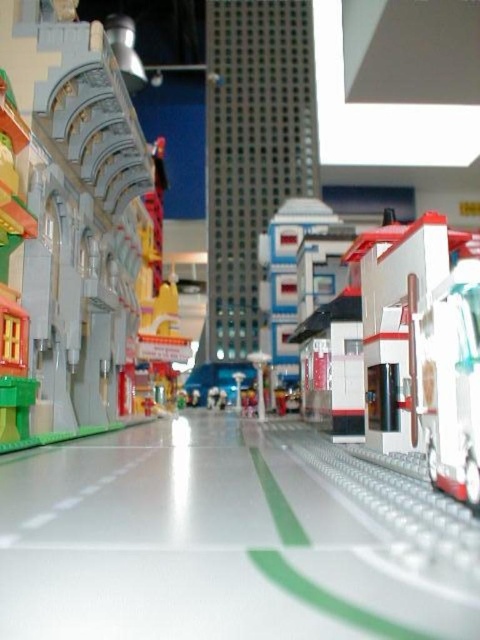
Question: Can you confirm if smooth gray building at left is wider than white plastic bus at center-right?

Choices:
 (A) yes
 (B) no

Answer: (A)

Question: Does smooth gray building at left have a lesser width compared to white plastic bus at center-right?

Choices:
 (A) yes
 (B) no

Answer: (B)

Question: Which point is closer to the camera?

Choices:
 (A) white plastic bus at center-right
 (B) smooth gray building at left

Answer: (A)

Question: Can you confirm if smooth gray building at left is bigger than white plastic bus at center-right?

Choices:
 (A) no
 (B) yes

Answer: (B)